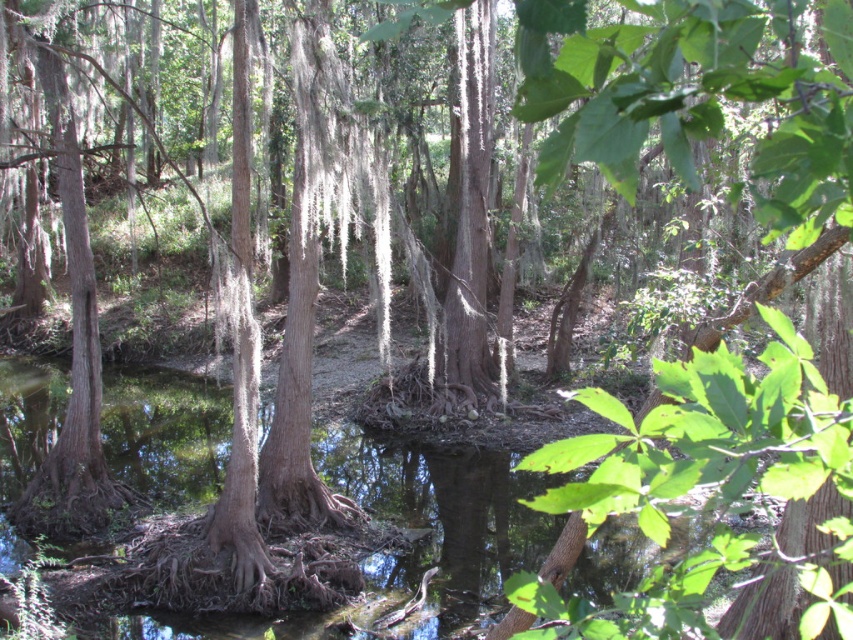
Is clear water at center above green leafy tree at center?

Incorrect, clear water at center is not positioned above green leafy tree at center.

This screenshot has height=640, width=853. What do you see at coordinates (442, 518) in the screenshot?
I see `clear water at center` at bounding box center [442, 518].

Image resolution: width=853 pixels, height=640 pixels. I want to click on clear water at center, so click(x=442, y=518).